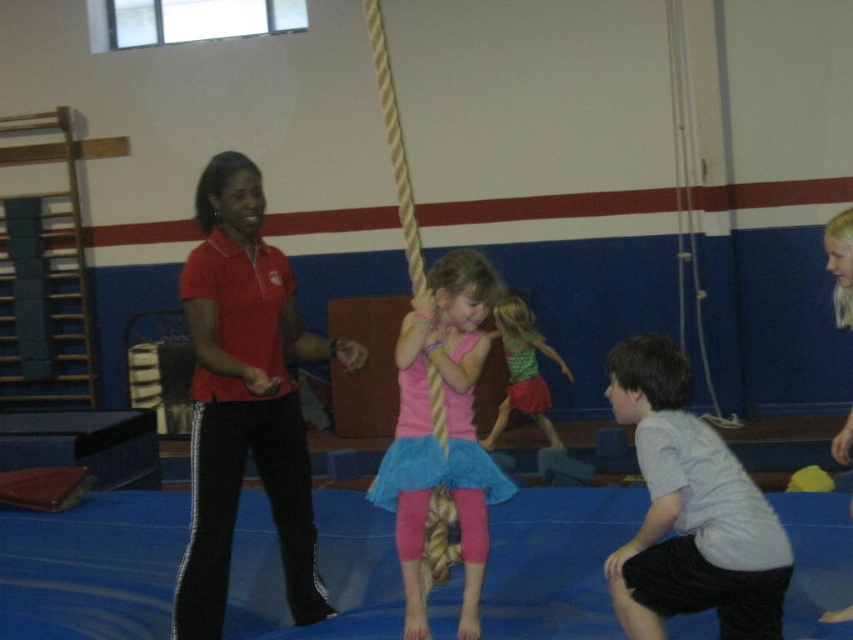
Consider the image. You are a photographer trying to capture both the pink satin skirt at center and the green textured dress at center in a single shot. Based on their heights, which one should you focus on first to ensure both are in frame?

The pink satin skirt at center is much taller than the green textured dress at center, so you should focus on the pink satin skirt at center first to ensure both are in frame.

You are a photographer positioned at the entrance of the gymnasium. You need to take a photo that includes both the gray cotton shirt at lower right and the green textured dress at center. Based on their positions, which object should you focus on first to ensure both are in clear view?

The gray cotton shirt at lower right is closer to the viewer than the green textured dress at center, so you should focus on the gray cotton shirt at lower right first to ensure both are in clear view.